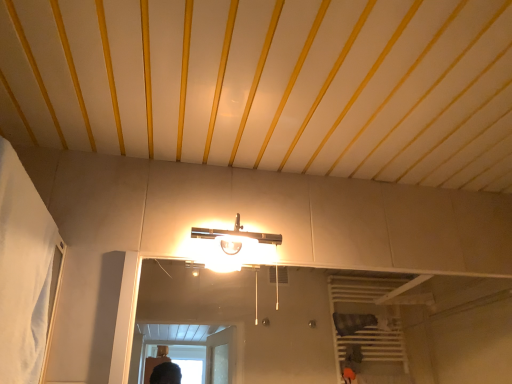
What do you see at coordinates (23, 271) in the screenshot? This screenshot has width=512, height=384. I see `white fabric curtain at left` at bounding box center [23, 271].

At what (x,y) coordinates should I click in order to perform the action: click on white fabric curtain at left. Please return your answer as a coordinate pair (x, y). The width and height of the screenshot is (512, 384). Looking at the image, I should click on (23, 271).

In order to face white fabric curtain at left, should I rotate leftwards or rightwards?

Rotate your view left by about 32.011°.

Image resolution: width=512 pixels, height=384 pixels. Describe the element at coordinates (234, 248) in the screenshot. I see `satin nickel fixture at center` at that location.

Where is `satin nickel fixture at center`? Image resolution: width=512 pixels, height=384 pixels. satin nickel fixture at center is located at coordinates (234, 248).

The height and width of the screenshot is (384, 512). Find the location of `white fabric curtain at left`. white fabric curtain at left is located at coordinates (23, 271).

Between satin nickel fixture at center and white fabric curtain at left, which one appears on the right side from the viewer's perspective?

From the viewer's perspective, satin nickel fixture at center appears more on the right side.

Is satin nickel fixture at center further to camera compared to white fabric curtain at left?

Yes, satin nickel fixture at center is behind white fabric curtain at left.

Does point (250, 256) come closer to viewer compared to point (17, 179)?

No.

From the image's perspective, is satin nickel fixture at center above or below white fabric curtain at left?

satin nickel fixture at center is situated lower than white fabric curtain at left in the image.

From a real-world perspective, is satin nickel fixture at center located beneath white fabric curtain at left?

Actually, satin nickel fixture at center is physically above white fabric curtain at left in the real world.

Is satin nickel fixture at center wider than white fabric curtain at left?

Yes, satin nickel fixture at center is wider than white fabric curtain at left.

Considering the sizes of satin nickel fixture at center and white fabric curtain at left in the image, is satin nickel fixture at center taller or shorter than white fabric curtain at left?

Considering their sizes, satin nickel fixture at center has less height than white fabric curtain at left.

Does satin nickel fixture at center have a larger size compared to white fabric curtain at left?

Actually, satin nickel fixture at center might be smaller than white fabric curtain at left.

Do you think satin nickel fixture at center is within white fabric curtain at left, or outside of it?

satin nickel fixture at center lies outside white fabric curtain at left.

Is the surface of satin nickel fixture at center in direct contact with white fabric curtain at left?

satin nickel fixture at center is not next to white fabric curtain at left, and they're not touching.

Is satin nickel fixture at center facing away from white fabric curtain at left?

No, white fabric curtain at left is not at the back of satin nickel fixture at center.

What are the coordinates of `light fixture that is on the right side of white fabric curtain at left` in the screenshot? It's located at (234, 248).

Is white fabric curtain at left to the left or to the right of satin nickel fixture at center in the image?

From the image, it's evident that white fabric curtain at left is to the left of satin nickel fixture at center.

Which object is closer to the camera taking this photo, white fabric curtain at left or satin nickel fixture at center?

Positioned in front is white fabric curtain at left.

Which point is more forward, (51, 256) or (226, 272)?

The point (51, 256) is more forward.

From the image's perspective, is white fabric curtain at left above or below satin nickel fixture at center?

Based on their image positions, white fabric curtain at left is located above satin nickel fixture at center.

From a real-world perspective, is white fabric curtain at left below satin nickel fixture at center?

Yes, from a real-world perspective, white fabric curtain at left is below satin nickel fixture at center.

Which object is wider, white fabric curtain at left or satin nickel fixture at center?

satin nickel fixture at center.

Considering the relative sizes of white fabric curtain at left and satin nickel fixture at center in the image provided, is white fabric curtain at left shorter than satin nickel fixture at center?

In fact, white fabric curtain at left may be taller than satin nickel fixture at center.

Is white fabric curtain at left smaller than satin nickel fixture at center?

No.

Would you say white fabric curtain at left contains satin nickel fixture at center?

No, satin nickel fixture at center is not a part of white fabric curtain at left.

Is there a large distance between white fabric curtain at left and satin nickel fixture at center?

Actually, white fabric curtain at left and satin nickel fixture at center are a little close together.

Is white fabric curtain at left facing away from satin nickel fixture at center?

No.

Image resolution: width=512 pixels, height=384 pixels. Identify the location of curtain that appears above the satin nickel fixture at center (from the image's perspective). (23, 271).

Image resolution: width=512 pixels, height=384 pixels. What are the coordinates of `curtain that is in front of the satin nickel fixture at center` in the screenshot? It's located at (23, 271).

The height and width of the screenshot is (384, 512). What are the coordinates of `light fixture behind the white fabric curtain at left` in the screenshot? It's located at (234, 248).